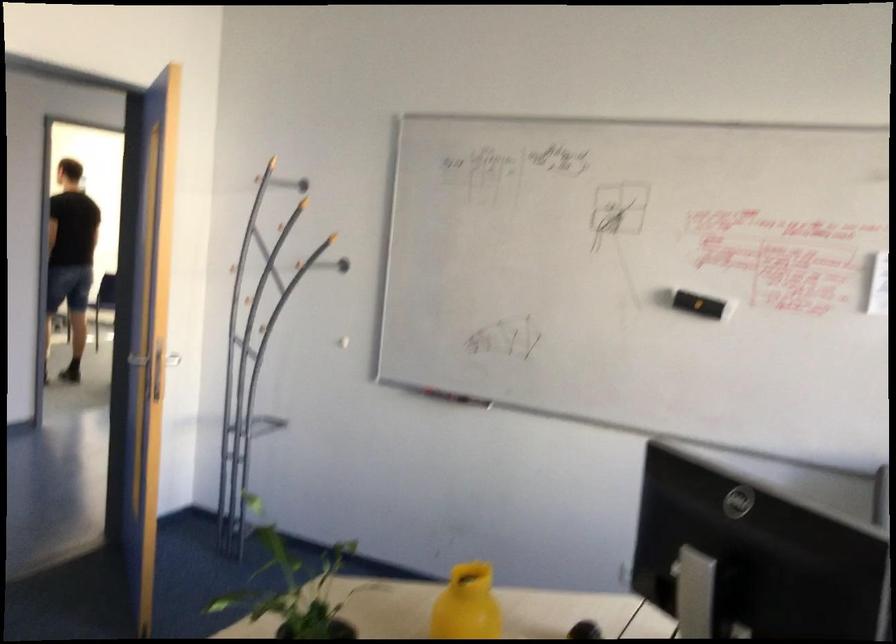
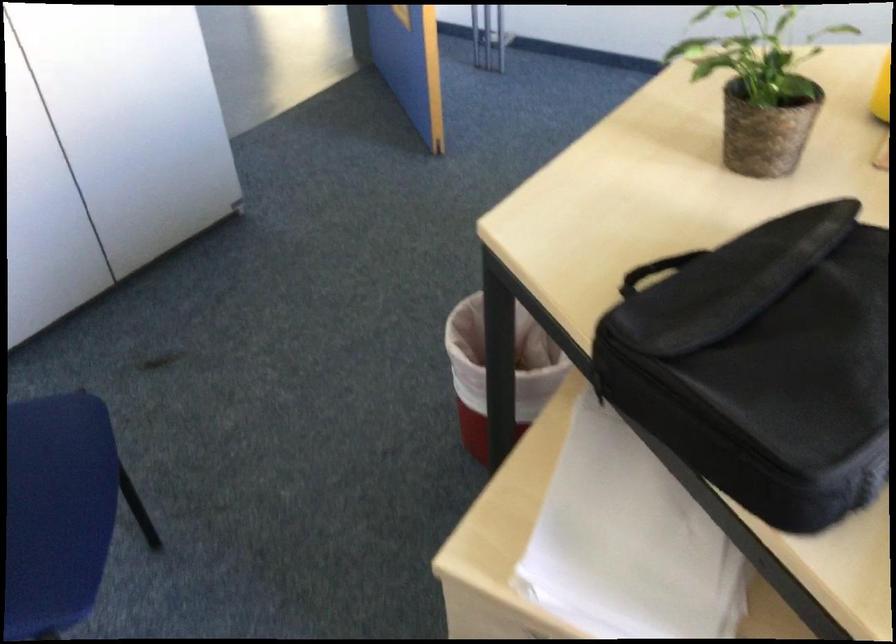
Question: How did the camera likely rotate?

Choices:
 (A) Left
 (B) Right
 (C) Up
 (D) Down

Answer: (D)